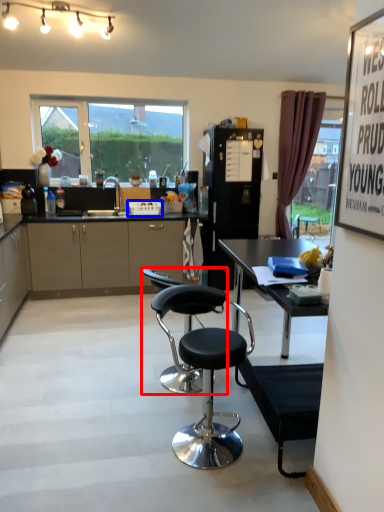
Question: Among these objects, which one is farthest to the camera, chair (highlighted by a red box) or picnic basket (highlighted by a blue box)?

Choices:
 (A) chair
 (B) picnic basket

Answer: (B)